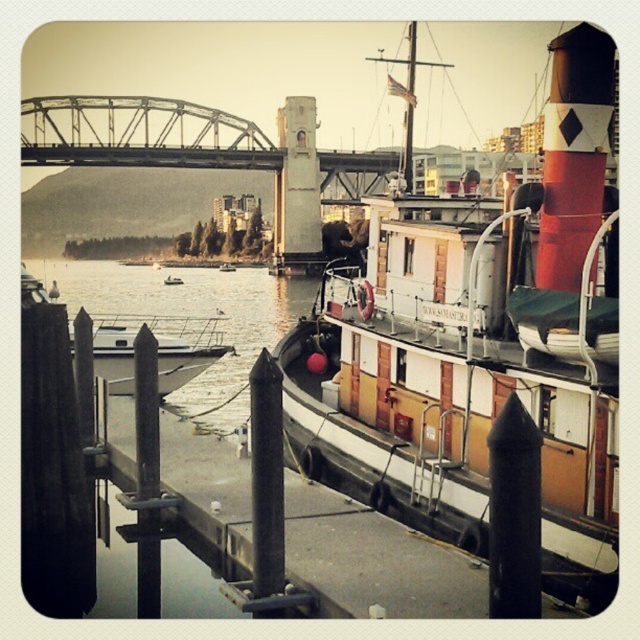
You are standing at the origin point of the scene. Which direction should you move to reach the smooth concrete dock at center?

The smooth concrete dock at center is located at point 0.878 on the x axis and 0.584 on the y axis, so you should move towards the right and slightly upwards to reach it.

You are a photographer positioned at the end of the dock and want to capture both the wooden cabin cruiser at center and the white glossy boat at center in a single shot. Which boat should you frame closer to the front of your camera frame to include both in the composition?

The wooden cabin cruiser at center is in front of the white glossy boat at center, so you should frame the wooden cabin cruiser at center closer to the front of your camera frame to include both in the composition.

You are standing on the smooth concrete dock at center and want to jump into the clear water at dock center. Based on the scene description, can you see the water before you jump?

Yes, because the smooth concrete dock at center is in front of clear water at dock center, so you can see the water before jumping.